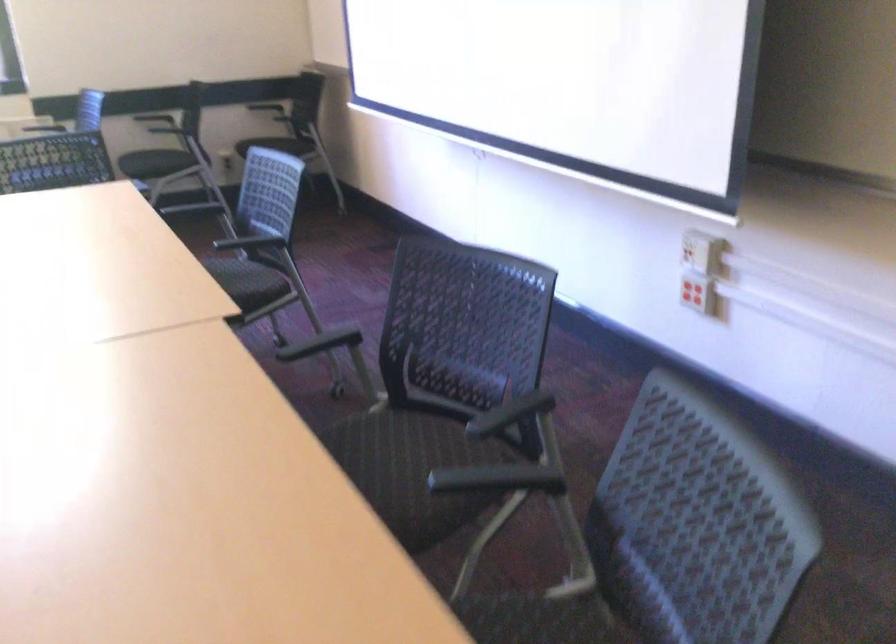
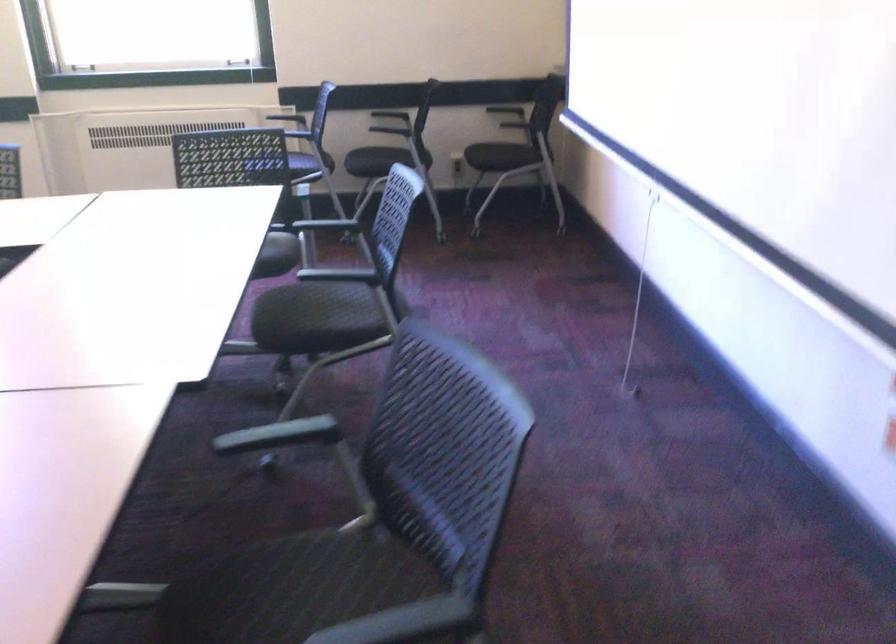
What movement of the cameraman would produce the second image?

The movement direction of the cameraman is right, forward.